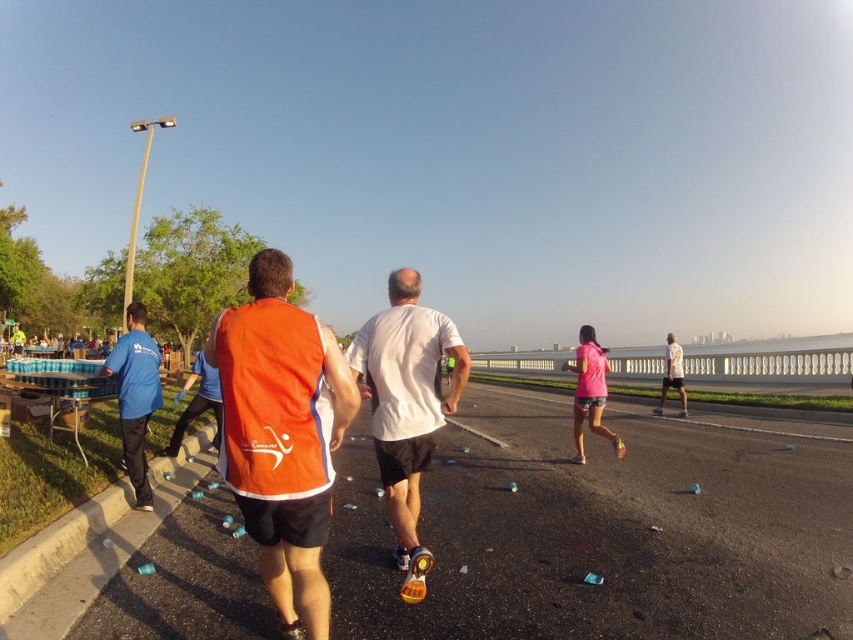
Is orange fabric vest at center wider than white matte shirt at center?

Yes, orange fabric vest at center is wider than white matte shirt at center.

Is orange fabric vest at center positioned at the back of white matte shirt at center?

No, it is not.

Image resolution: width=853 pixels, height=640 pixels. In order to click on orange fabric vest at center in this screenshot , I will do `click(281, 435)`.

Looking at this image, can you confirm if orange fabric vest at center is thinner than blue fabric shirt at left?

Yes.

Is point (300, 600) positioned behind point (125, 362)?

No, (300, 600) is closer to viewer.

Between point (273, 480) and point (141, 364), which one is positioned behind?

Positioned behind is point (141, 364).

The height and width of the screenshot is (640, 853). I want to click on orange fabric vest at center, so click(281, 435).

Which is in front, point (126, 381) or point (593, 369)?

Point (126, 381) is in front.

Does blue fabric shirt at left have a lesser width compared to pink matte shorts at center?

Correct, blue fabric shirt at left's width is less than pink matte shorts at center's.

Which is behind, point (148, 340) or point (599, 364)?

The point (599, 364) is more distant.

Find the location of a particular element. blue fabric shirt at left is located at coordinates (135, 396).